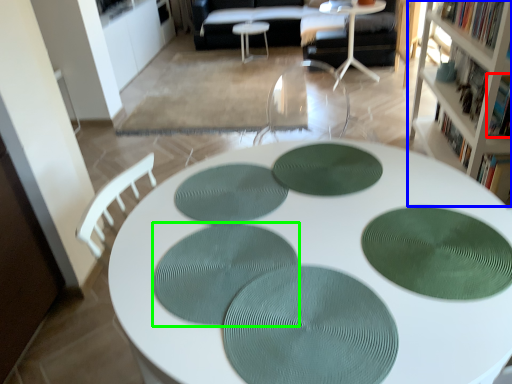
Question: Which object is the closest to the book (highlighted by a red box)? Choose among these: cabinetry (highlighted by a blue box) or mat (highlighted by a green box).

Choices:
 (A) cabinetry
 (B) mat

Answer: (A)